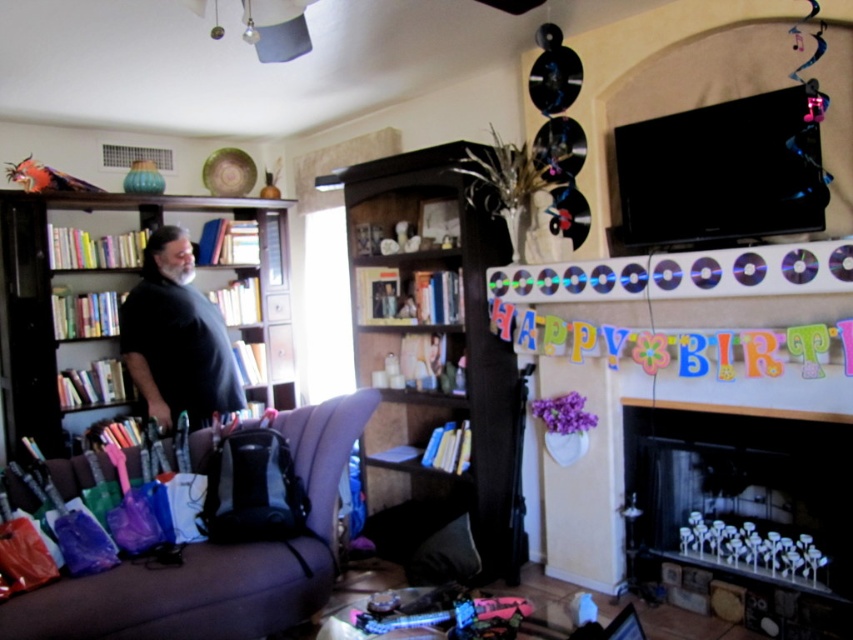
You are a guest entering the living room and want to place a birthday card on the mantel above the fireplace. Which object should you look for first, the black glass fireplace at lower right or the brown fabric couch at lower left?

The black glass fireplace at lower right is above the brown fabric couch at lower left, so you should look for the black glass fireplace at lower right first to place the birthday card on the mantel.

You are planning to place a tall potted plant in the living room. The potted plant is taller than the black glass fireplace at lower right but shorter than the brown fabric couch at lower left. Based on the scene description, where would be the best place to position it so it doesn

The best place to position the potted plant would be near the brown fabric couch at lower left since it is taller than the black glass fireplace at lower right and shorter than the brown fabric couch at lower left, ensuring it fits appropriately within the space.